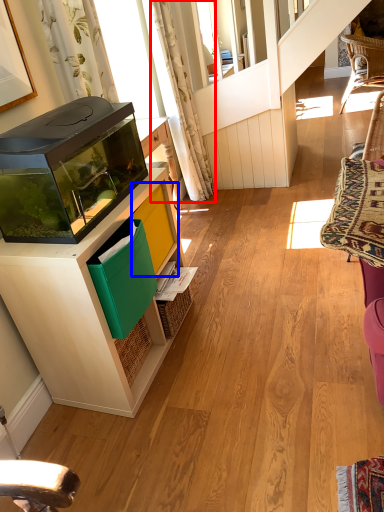
Question: Which point is further to the camera, curtain (highlighted by a red box) or shelf (highlighted by a blue box)?

Choices:
 (A) curtain
 (B) shelf

Answer: (A)